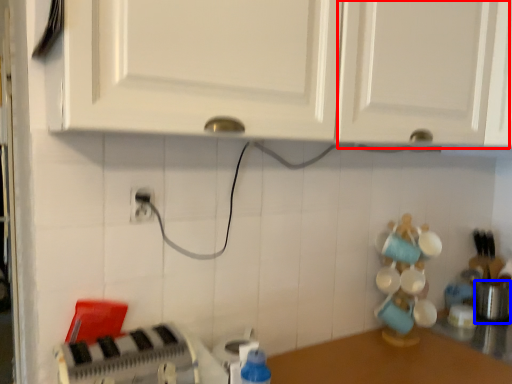
Question: Which object is further to the camera taking this photo, cabinetry (highlighted by a red box) or appliance (highlighted by a blue box)?

Choices:
 (A) cabinetry
 (B) appliance

Answer: (B)